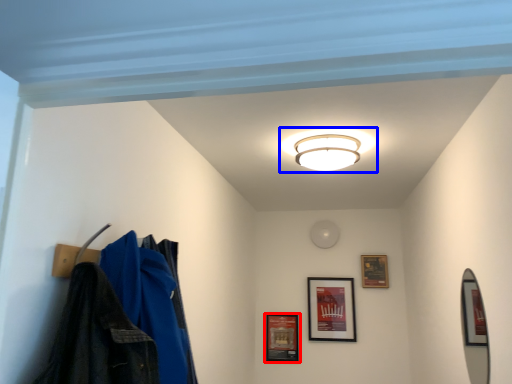
Question: Which of the following is the farthest to the observer, picture frame (highlighted by a red box) or lamp (highlighted by a blue box)?

Choices:
 (A) picture frame
 (B) lamp

Answer: (A)